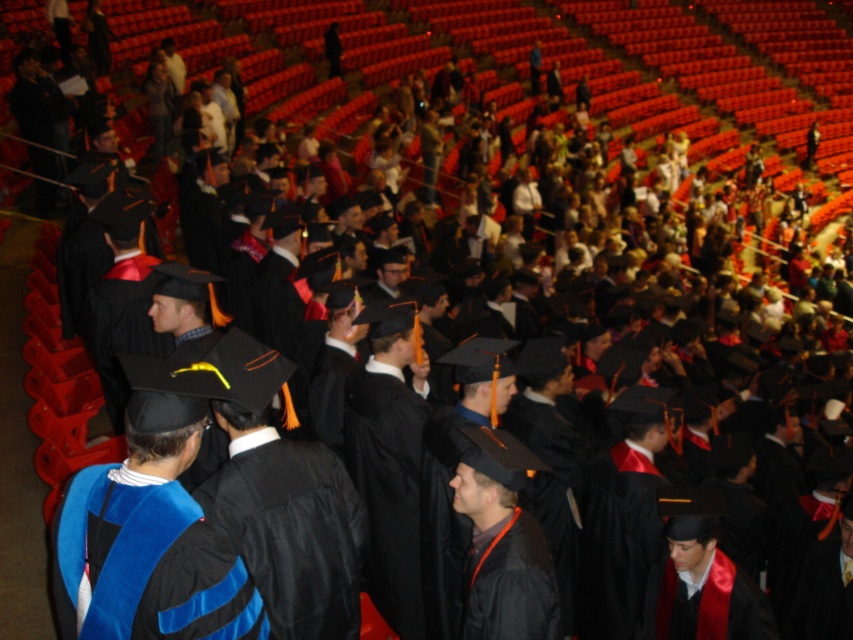
You are a photographer at the graduation ceremony and want to capture a closeup of the black matte graduation gown at center and the matte black graduation gown at center. Which one should you focus on if you want to emphasize its size in the photo?

The black matte graduation gown at center is bigger than the matte black graduation gown at center, so focusing on it will emphasize its larger size in the photo.